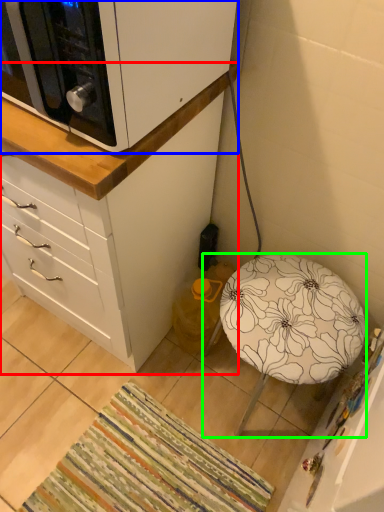
Question: Estimate the real-world distances between objects in this image. Which object is closer to chest of drawers (highlighted by a red box), cabinetry (highlighted by a blue box) or furniture (highlighted by a green box)?

Choices:
 (A) cabinetry
 (B) furniture

Answer: (A)